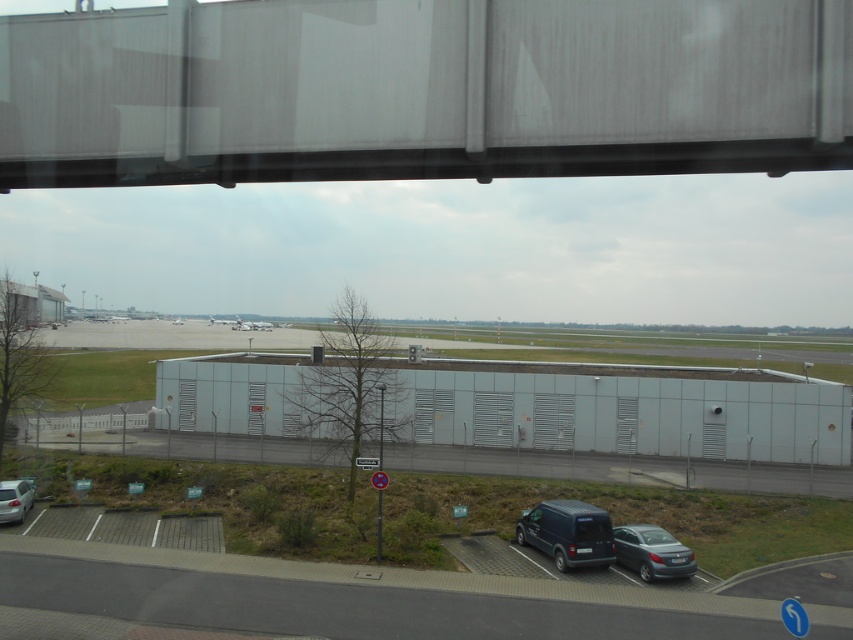
Consider the image. Does metallic gray overpass at upper center have a greater width compared to gray concrete runway at lower center?

In fact, metallic gray overpass at upper center might be narrower than gray concrete runway at lower center.

Where is `metallic gray overpass at upper center`? metallic gray overpass at upper center is located at coordinates (422, 90).

Consider the image. Which is more to the right, dark gray matte van at lower right or silver metallic airplane at center?

dark gray matte van at lower right is more to the right.

Where is `dark gray matte van at lower right`? dark gray matte van at lower right is located at coordinates (567, 532).

Measure the distance between point (602, 561) and camera.

Point (602, 561) is 74.97 feet from camera.

You are a GUI agent. You are given a task and a screenshot of the screen. Output one action in this format:
    pyautogui.click(x=<x>, y=<y>)
    Task: Click on the dark gray matte van at lower right
    The height and width of the screenshot is (640, 853).
    Given the screenshot: What is the action you would take?
    pyautogui.click(x=567, y=532)

Consider the image. Does gray concrete runway at lower center appear on the left side of dark gray matte van at lower right?

Correct, you'll find gray concrete runway at lower center to the left of dark gray matte van at lower right.

Does gray concrete runway at lower center have a greater width compared to dark gray matte van at lower right?

Yes.

Where is `gray concrete runway at lower center`? This screenshot has height=640, width=853. gray concrete runway at lower center is located at coordinates (352, 596).